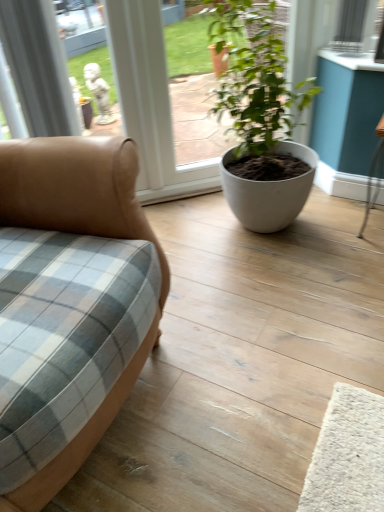
Question: From a real-world perspective, is tan leather couch at left above or below white matte pot at center?

Choices:
 (A) above
 (B) below

Answer: (A)

Question: Is point (132, 158) closer or farther from the camera than point (248, 64)?

Choices:
 (A) farther
 (B) closer

Answer: (B)

Question: Considering their positions, is tan leather couch at left located in front of or behind white matte pot at center?

Choices:
 (A) behind
 (B) front

Answer: (B)

Question: From the image's perspective, is white matte pot at center located above or below tan leather couch at left?

Choices:
 (A) above
 (B) below

Answer: (A)

Question: Is white matte pot at center wider or thinner than tan leather couch at left?

Choices:
 (A) wide
 (B) thin

Answer: (B)

Question: Considering their positions, is white matte pot at center located in front of or behind tan leather couch at left?

Choices:
 (A) behind
 (B) front

Answer: (A)

Question: From a real-world perspective, is white matte pot at center above or below tan leather couch at left?

Choices:
 (A) above
 (B) below

Answer: (B)